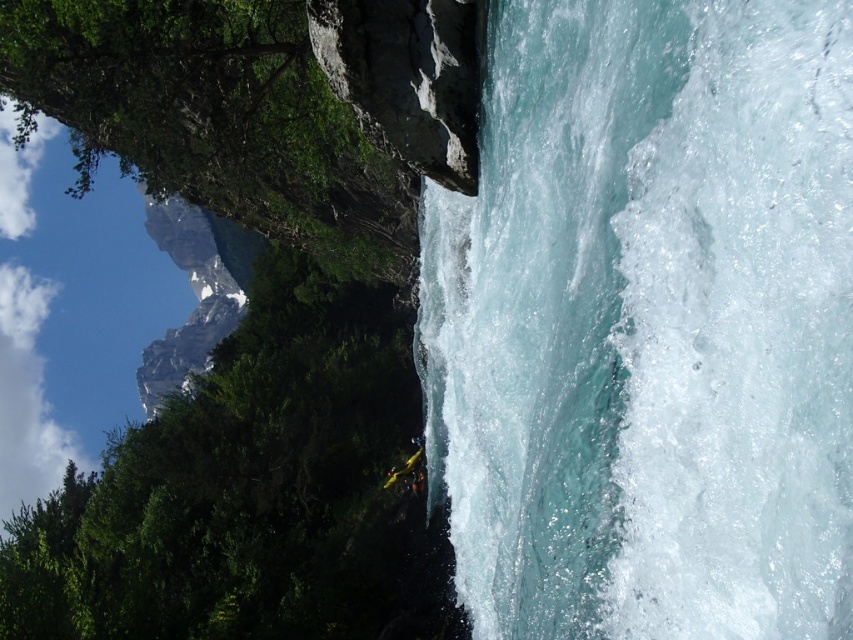
You are a kayaker navigating the rapids and want to reach a point downstream. You see two points marked in the scene, point (x=699, y=278) and point (x=421, y=444). Which point is closer to you as you paddle forward?

Point (x=699, y=278) is closer to the viewer than point (x=421, y=444), so the point (x=699, y=278) is closer to you as you paddle forward.

You are a kayaker preparing to navigate the rapids shown in the image. You see the clear water at center and the yellow plastic kayak at lower center. Which object is positioned higher in the scene?

The clear water at center is above the yellow plastic kayak at lower center, so the clear water at center is positioned higher in the scene.

You are a photographer planning to capture the whitewater kayaking scene. You want to ensure that both the clear water at center and the yellow plastic kayak at lower center are visible in your shot. Given their sizes, which object should you focus on to frame the shot properly?

The clear water at center is larger in size than the yellow plastic kayak at lower center, so you should focus on the clear water at center to frame the shot properly as it occupies more space in the scene.